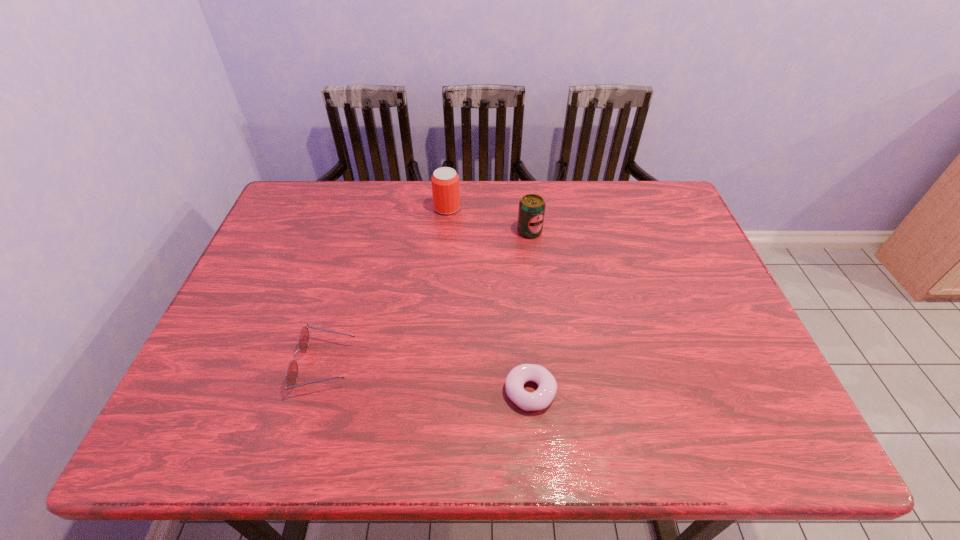
In order to click on vacant area situated 0.150m on the back of the doughnut in this screenshot , I will do `click(524, 318)`.

Where is `object located at the near edge`? The width and height of the screenshot is (960, 540). object located at the near edge is located at coordinates (541, 398).

The image size is (960, 540). In the image, there is a desktop. What are the coordinates of `vacant area at the far edge` in the screenshot? It's located at (510, 201).

This screenshot has height=540, width=960. I want to click on vacant space at the near edge, so click(x=409, y=421).

Identify the location of free spot at the left edge of the desktop. This screenshot has width=960, height=540. (290, 254).

This screenshot has width=960, height=540. I want to click on free space at the right edge of the desktop, so click(711, 283).

In the image, there is a desktop. Identify the location of vacant area at the far right corner. (677, 217).

At what (x,y) coordinates should I click in order to perform the action: click on blank region between the shortest object and the right beer can. Please return your answer as a coordinate pair (x, y). Looking at the image, I should click on (530, 312).

Where is `empty location between the leftmost object and the doughnut`? This screenshot has height=540, width=960. empty location between the leftmost object and the doughnut is located at coordinates (428, 378).

Image resolution: width=960 pixels, height=540 pixels. I want to click on vacant region between the doughnut and the farthest object, so click(x=489, y=300).